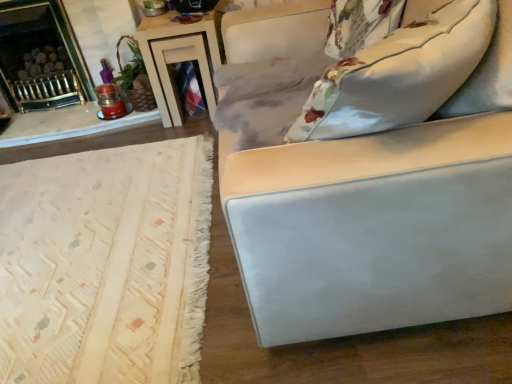
Question: From a real-world perspective, relative to wooden table at upper center, is floral fabric pillow at upper right vertically above or below?

Choices:
 (A) above
 (B) below

Answer: (A)

Question: Is floral fabric pillow at upper right in front of or behind wooden table at upper center in the image?

Choices:
 (A) behind
 (B) front

Answer: (B)

Question: Considering the real-world distances, which object is farthest from the brushed metal fireplace at upper left?

Choices:
 (A) wooden table at upper center
 (B) floral fabric pillow at upper right

Answer: (B)

Question: Which object is the farthest from the floral fabric pillow at upper right?

Choices:
 (A) wooden table at upper center
 (B) brushed metal fireplace at upper left

Answer: (B)